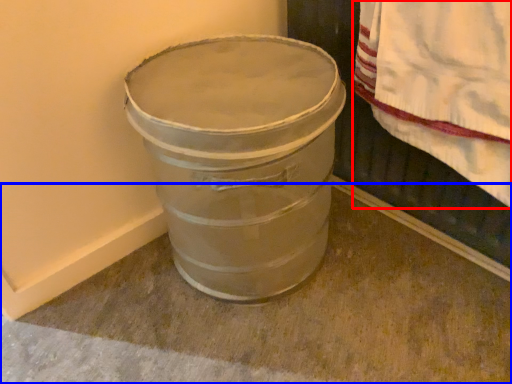
Question: Which of the following is the farthest to the observer, blanket (highlighted by a red box) or concrete (highlighted by a blue box)?

Choices:
 (A) blanket
 (B) concrete

Answer: (A)